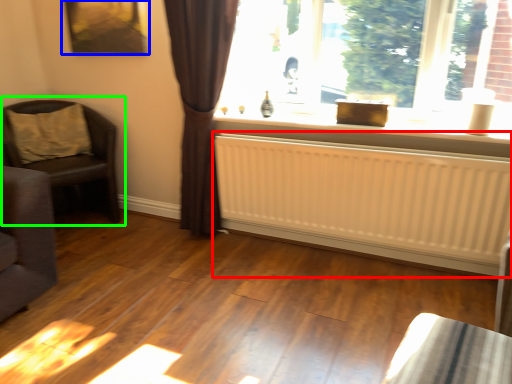
Question: Estimate the real-world distances between objects in this image. Which object is farther from radiator (highlighted by a red box), picture frame (highlighted by a blue box) or chair (highlighted by a green box)?

Choices:
 (A) picture frame
 (B) chair

Answer: (A)